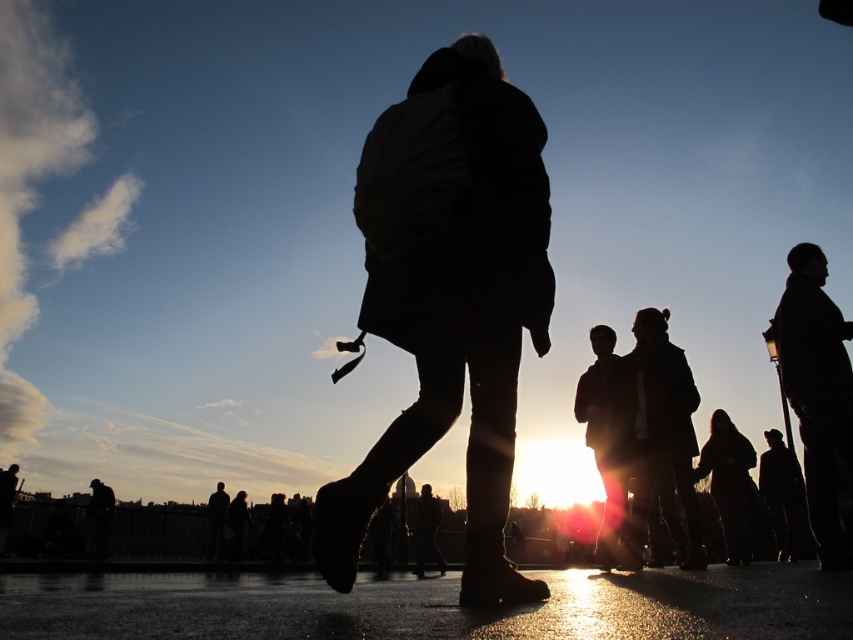
Can you confirm if black matte coat at center is taller than black matte jacket at upper right?

Incorrect, black matte coat at center's height is not larger of black matte jacket at upper right's.

What do you see at coordinates (450, 298) in the screenshot? Image resolution: width=853 pixels, height=640 pixels. I see `black matte coat at center` at bounding box center [450, 298].

What do you see at coordinates (450, 298) in the screenshot? I see `black matte coat at center` at bounding box center [450, 298].

The width and height of the screenshot is (853, 640). In order to click on black matte coat at center in this screenshot , I will do (450, 298).